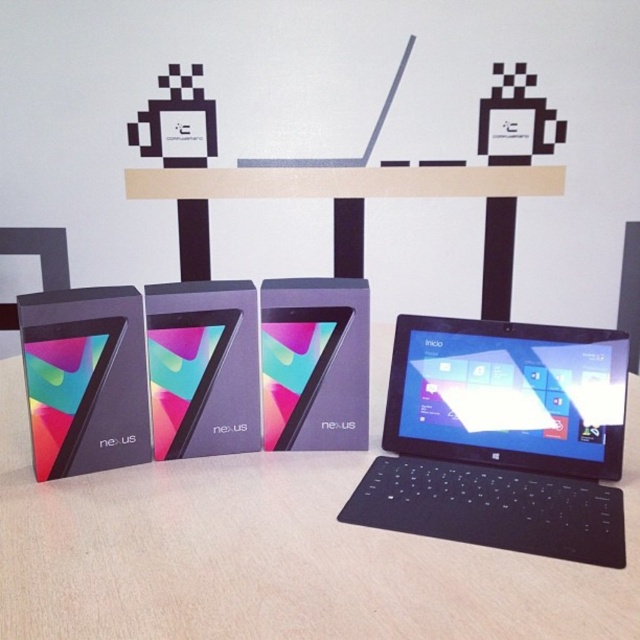
You are setting up a new workspace and need to place both the matte black table at center and the black plastic table at center. According to the image, which table should be placed lower to ensure proper arrangement?

The matte black table at center should be placed lower than the black plastic table at center because the matte black table at center is below black plastic table at center in the image.

You are standing in front of the display setup and need to reach a specific point. Which of the two points, point (573,554) or point (284,355), is closer to you?

Point (573,554) is in front of point (284,355), so it is closer to you.